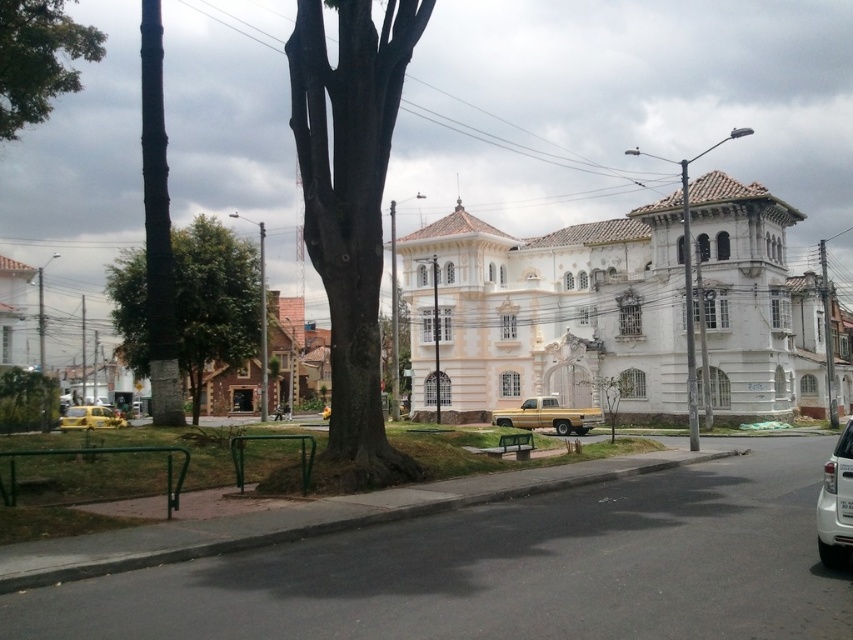
Question: Which object is farther from the camera taking this photo?

Choices:
 (A) yellow matte taxi at lower left
 (B) brown rough bark tree at center
 (C) green leafy tree at upper left

Answer: (A)

Question: From the image, what is the correct spatial relationship of green leafy tree at lower left in relation to green leafy tree at center?

Choices:
 (A) above
 (B) below

Answer: (B)

Question: In this image, where is green leafy tree at left located relative to green leafy tree at center?

Choices:
 (A) above
 (B) below

Answer: (A)

Question: Which of the following is the closest to the observer?

Choices:
 (A) (18, 317)
 (B) (477, 218)

Answer: (A)

Question: Which point is farther from the camera taking this photo?

Choices:
 (A) (25, 305)
 (B) (554, 362)
 (C) (828, 536)

Answer: (A)

Question: Is white stucco palace at center wider than brown rough bark tree at center?

Choices:
 (A) yes
 (B) no

Answer: (A)